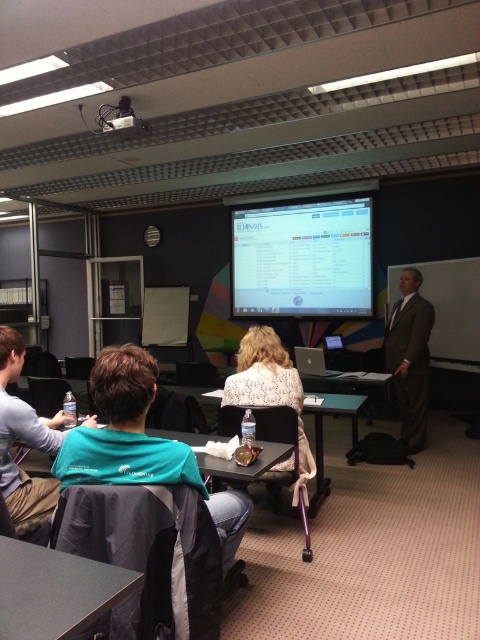
Question: Which of the following is the closest to the observer?

Choices:
 (A) teal fabric shirt at center
 (B) white plastic projector at upper center
 (C) black plastic table at center
 (D) smooth gray table at lower left

Answer: (D)

Question: Is matte plastic monitor at center below white textured blouse at center?

Choices:
 (A) no
 (B) yes

Answer: (A)

Question: Which object is closer to the camera taking this photo?

Choices:
 (A) white textured blouse at center
 (B) smooth gray table at lower left
 (C) black plastic table at center
 (D) white plastic projector at upper center

Answer: (B)

Question: Which point is closer to the camera?

Choices:
 (A) matte plastic monitor at center
 (B) white plastic projector at upper center
 (C) white textured blouse at center

Answer: (C)

Question: Is satin brown suit at right in front of black plastic table at center?

Choices:
 (A) yes
 (B) no

Answer: (B)

Question: Does teal fabric shirt at center come behind satin brown suit at right?

Choices:
 (A) yes
 (B) no

Answer: (B)